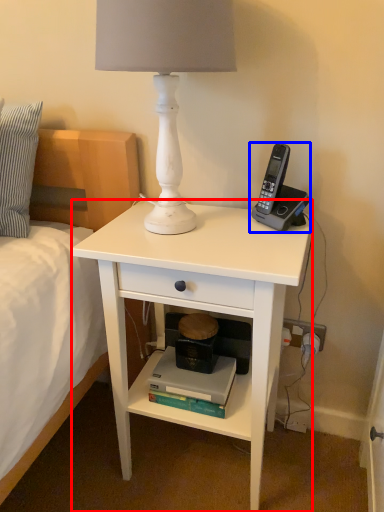
Question: Among these objects, which one is farthest to the camera, desk (highlighted by a red box) or corded phone (highlighted by a blue box)?

Choices:
 (A) desk
 (B) corded phone

Answer: (B)